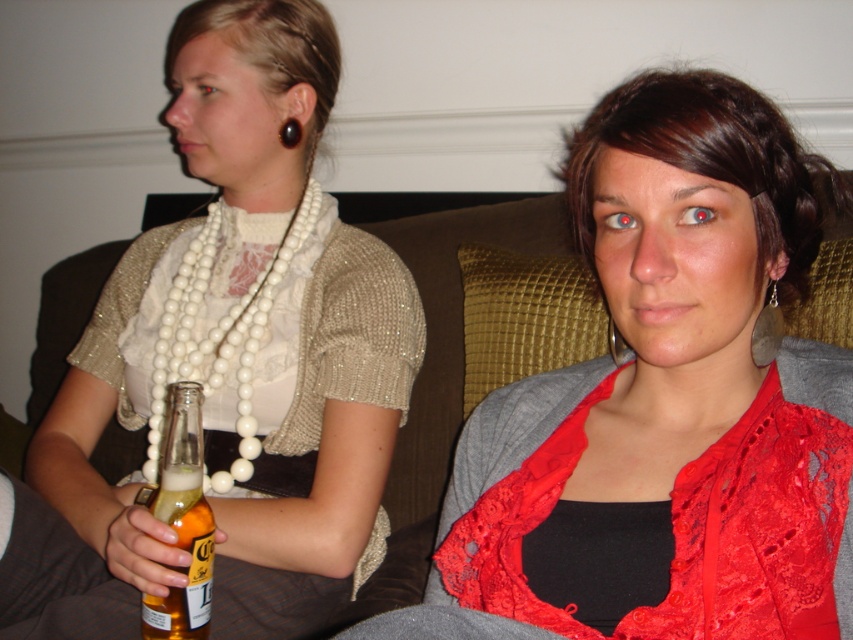
Based on the photo, you are a photographer trying to capture a closeup of the pearl necklace at left and the translucent glass bottle at lower left. Which object should you focus on first if you want to ensure both are in focus without moving the camera?

The pearl necklace at left is much taller than the translucent glass bottle at lower left, so focusing on the pearl necklace at left first would ensure both are in focus since it is larger and closer to the camera.